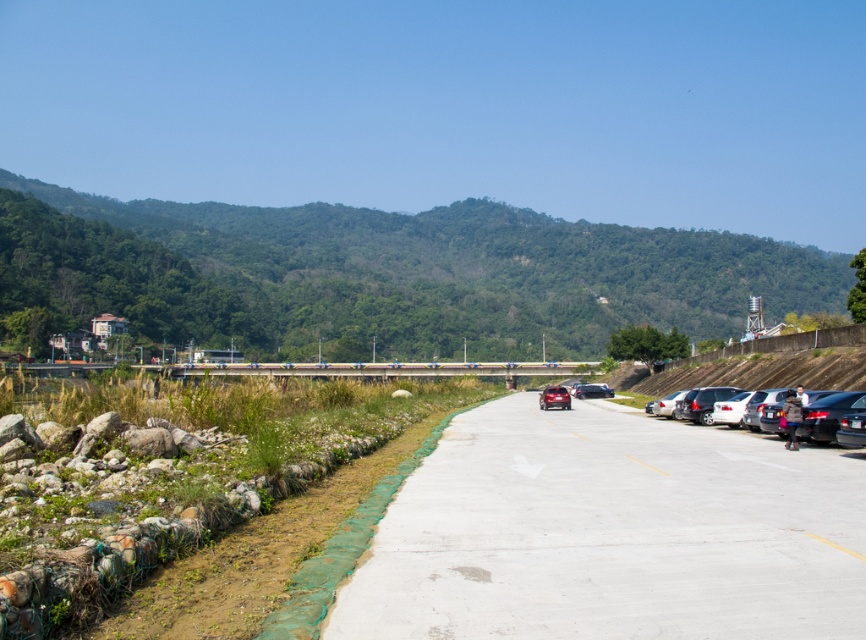
Question: Can you confirm if metallic highway at center is smaller than shiny black car at center?

Choices:
 (A) no
 (B) yes

Answer: (A)

Question: Does white glossy sedan at right have a greater width compared to satin red car at center?

Choices:
 (A) yes
 (B) no

Answer: (B)

Question: Is metallic highway at center smaller than silver metallic car at right?

Choices:
 (A) yes
 (B) no

Answer: (B)

Question: Which of these objects is positioned closest to the white glossy sedan at right?

Choices:
 (A) silver metallic car at right
 (B) satin silver sedan at lower right
 (C) metallic highway at center
 (D) shiny black car at center

Answer: (A)

Question: Which point is closer to the camera taking this photo?

Choices:
 (A) (85, 365)
 (B) (574, 394)
 (C) (661, 410)

Answer: (C)

Question: Which point appears closest to the camera in this image?

Choices:
 (A) (735, 426)
 (B) (658, 400)

Answer: (A)